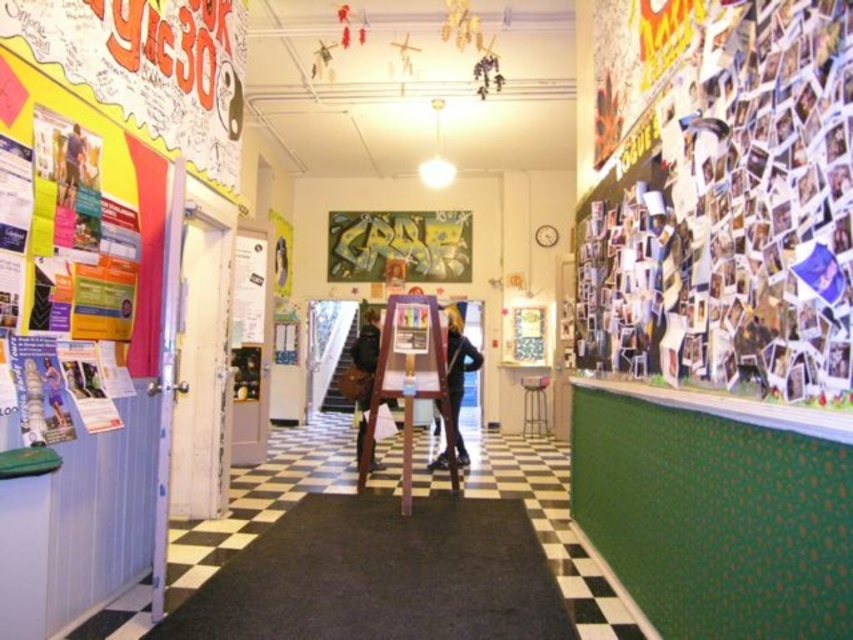
Which is more to the right, multicolored collage at right or dark brown leather jacket at center?

multicolored collage at right

Where is `multicolored collage at right`? multicolored collage at right is located at coordinates (722, 198).

This screenshot has width=853, height=640. What do you see at coordinates (722, 198) in the screenshot?
I see `multicolored collage at right` at bounding box center [722, 198].

Locate an element on the screen. multicolored collage at right is located at coordinates (722, 198).

Who is taller, multicolored collage at right or green matte poster at center?

With more height is multicolored collage at right.

Is multicolored collage at right below green matte poster at center?

Yes, multicolored collage at right is below green matte poster at center.

Does point (831, 3) come behind point (347, 243)?

That is False.

The height and width of the screenshot is (640, 853). Find the location of `multicolored collage at right`. multicolored collage at right is located at coordinates (722, 198).

Who is shorter, black leather pants at center or metallic stool at center?

Standing shorter between the two is metallic stool at center.

The height and width of the screenshot is (640, 853). What are the coordinates of `black leather pants at center` in the screenshot? It's located at (457, 372).

Is point (461, 340) positioned after point (543, 406)?

No.

Locate an element on the screen. black leather pants at center is located at coordinates (457, 372).